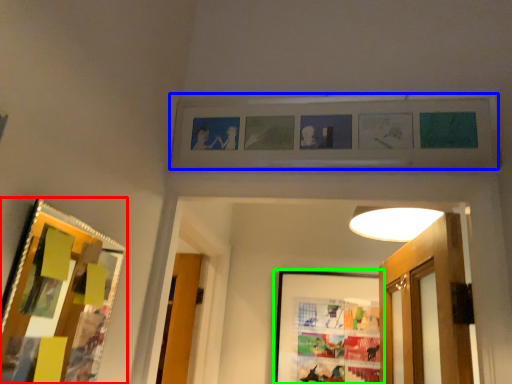
Question: Which is farther away from picture frame (highlighted by a red box)? picture frame (highlighted by a blue box) or picture frame (highlighted by a green box)?

Choices:
 (A) picture frame
 (B) picture frame

Answer: (B)